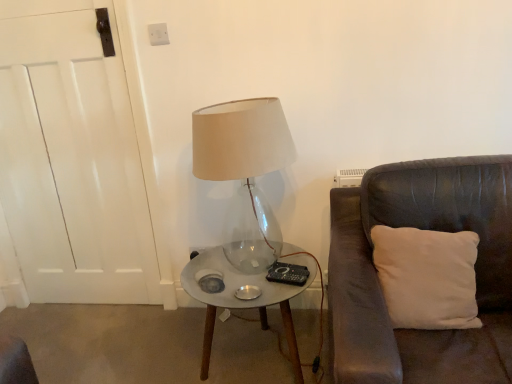
Describe the element at coordinates (249, 300) in the screenshot. This screenshot has height=384, width=512. I see `clear glass table at center` at that location.

Describe the element at coordinates (245, 169) in the screenshot. The height and width of the screenshot is (384, 512). I see `transparent glass lamp at center` at that location.

I want to click on clear glass table at center, so click(249, 300).

Is the position of white soft cushion at right more distant than that of clear glass table at center?

That is False.

Which of these two, white soft cushion at right or clear glass table at center, is smaller?

Smaller between the two is white soft cushion at right.

Does white soft cushion at right turn towards clear glass table at center?

No, white soft cushion at right is not oriented towards clear glass table at center.

Is white soft cushion at right not inside clear glass table at center?

Yes, white soft cushion at right is not within clear glass table at center.

Does point (231, 258) appear closer or farther from the camera than point (224, 281)?

Point (231, 258) is farther from the camera than point (224, 281).

Where is `table behind the transparent glass lamp at center`? The image size is (512, 384). table behind the transparent glass lamp at center is located at coordinates (249, 300).

Is transparent glass lamp at center facing towards clear glass table at center?

No, transparent glass lamp at center is not facing towards clear glass table at center.

Does transparent glass lamp at center appear on the right side of clear glass table at center?

Incorrect, transparent glass lamp at center is not on the right side of clear glass table at center.

Can you confirm if white soft cushion at right is smaller than transparent glass lamp at center?

Correct, white soft cushion at right occupies less space than transparent glass lamp at center.

Is point (473, 297) in front of point (242, 162)?

Yes, point (473, 297) is in front of point (242, 162).

Between white soft cushion at right and transparent glass lamp at center, which one has more height?

transparent glass lamp at center.

Can you tell me how much transparent glass lamp at center and white soft cushion at right differ in facing direction?

The angular difference between transparent glass lamp at center and white soft cushion at right is 3.39 degrees.

Could you tell me if transparent glass lamp at center is facing white soft cushion at right?

No, transparent glass lamp at center is not turned towards white soft cushion at right.

Is transparent glass lamp at center not inside white soft cushion at right?

Yes, transparent glass lamp at center is not within white soft cushion at right.

Considering the relative sizes of clear glass table at center and white soft cushion at right in the image provided, is clear glass table at center thinner than white soft cushion at right?

No, clear glass table at center is not thinner than white soft cushion at right.

Considering their positions, is clear glass table at center located in front of or behind white soft cushion at right?

In the image, clear glass table at center appears behind white soft cushion at right.

At what (x,y) coordinates should I click in order to perform the action: click on table directly beneath the white soft cushion at right (from a real-world perspective). Please return your answer as a coordinate pair (x, y). This screenshot has width=512, height=384. Looking at the image, I should click on (249, 300).

Is clear glass table at center not close to white soft cushion at right?

No.

What's the angular difference between clear glass table at center and transparent glass lamp at center's facing directions?

The angular difference between clear glass table at center and transparent glass lamp at center is 0.000135 degrees.

Is point (218, 268) positioned after point (264, 212)?

No.

Is clear glass table at center to the left of transparent glass lamp at center from the viewer's perspective?

In fact, clear glass table at center is to the right of transparent glass lamp at center.

Is clear glass table at center far from transparent glass lamp at center?

clear glass table at center is actually quite close to transparent glass lamp at center.

There is a clear glass table at center. Identify the location of pillow above it (from a real-world perspective). This screenshot has height=384, width=512. (426, 277).

You are a GUI agent. You are given a task and a screenshot of the screen. Output one action in this format:
    pyautogui.click(x=<x>, y=<y>)
    Task: Click on the table that appears below the transparent glass lamp at center (from a real-world perspective)
    
    Given the screenshot: What is the action you would take?
    pyautogui.click(x=249, y=300)

Which object lies further to the anchor point transparent glass lamp at center, clear glass table at center or white soft cushion at right?

Among the two, white soft cushion at right is located further to transparent glass lamp at center.

From the image, which object appears to be farther from clear glass table at center, transparent glass lamp at center or white soft cushion at right?

transparent glass lamp at center is further to clear glass table at center.

Looking at the image, which one is located closer to clear glass table at center, white soft cushion at right or transparent glass lamp at center?

white soft cushion at right.

From the image, which object appears to be farther from white soft cushion at right, transparent glass lamp at center or clear glass table at center?

transparent glass lamp at center.

Consider the image. Estimate the real-world distances between objects in this image. Which object is closer to transparent glass lamp at center, white soft cushion at right or clear glass table at center?

Among the two, clear glass table at center is located nearer to transparent glass lamp at center.

From the image, which object appears to be farther from white soft cushion at right, clear glass table at center or transparent glass lamp at center?

The object further to white soft cushion at right is transparent glass lamp at center.

Where is `table situated between transparent glass lamp at center and white soft cushion at right from left to right`? The image size is (512, 384). table situated between transparent glass lamp at center and white soft cushion at right from left to right is located at coordinates (249, 300).